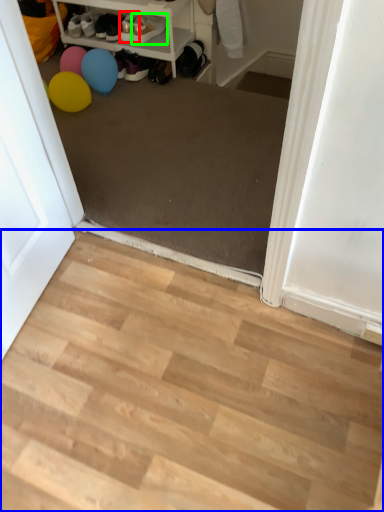
Question: Which is farther away from footwear (highlighted by a red box)? stairwell (highlighted by a blue box) or footwear (highlighted by a green box)?

Choices:
 (A) stairwell
 (B) footwear

Answer: (A)